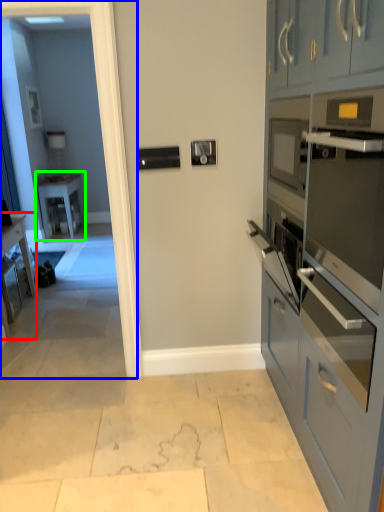
Question: Considering the real-world distances, which object is farthest from desk (highlighted by a red box)? glass door (highlighted by a blue box) or table (highlighted by a green box)?

Choices:
 (A) glass door
 (B) table

Answer: (B)